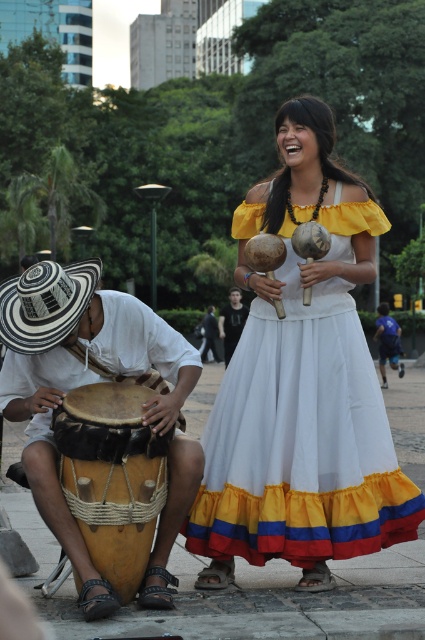
Question: Among these objects, which one is farthest from the camera?

Choices:
 (A) white cotton dress at center
 (B) dark brown leather drum at center
 (C) leather drum at lower left
 (D) brown leather drum at lower left

Answer: (B)

Question: Where is brown leather drum at lower left located in relation to dark brown leather drum at center in the image?

Choices:
 (A) above
 (B) below

Answer: (B)

Question: Can you confirm if white cotton dress at center is positioned to the left of dark brown leather drum at center?

Choices:
 (A) yes
 (B) no

Answer: (B)

Question: Which object is positioned closest to the dark brown leather drum at center?

Choices:
 (A) brown leather drum at lower left
 (B) white cotton dress at center

Answer: (A)

Question: Among these objects, which one is farthest from the camera?

Choices:
 (A) white cotton dress at center
 (B) leather drum at lower left
 (C) brown leather drum at lower left
 (D) dark brown leather drum at center

Answer: (D)

Question: Is white cotton dress at center smaller than dark brown leather drum at center?

Choices:
 (A) no
 (B) yes

Answer: (B)